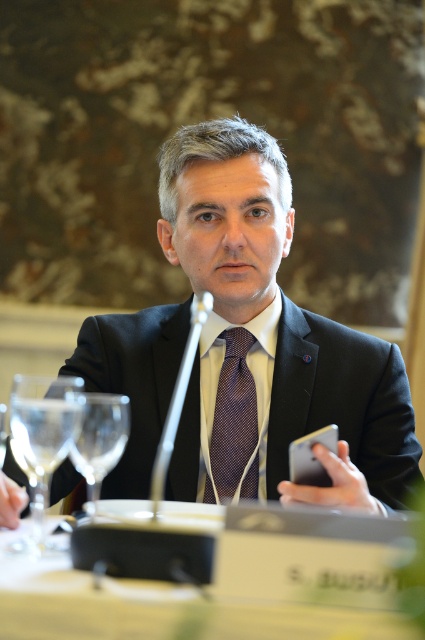
Question: Which object is positioned farthest from the clear glass wine glass at left?

Choices:
 (A) matte black suit at center
 (B) transparent glass at left

Answer: (A)

Question: Which of the following is the closest to the observer?

Choices:
 (A) white plastic table at center
 (B) transparent glass at left

Answer: (A)

Question: Does transparent glass at left appear on the right side of purple dotted tie at center?

Choices:
 (A) yes
 (B) no

Answer: (B)

Question: Where is matte black suit at center located in relation to purple dotted tie at center in the image?

Choices:
 (A) below
 (B) above

Answer: (B)

Question: Does white plastic table at center have a lesser width compared to purple dotted tie at center?

Choices:
 (A) no
 (B) yes

Answer: (A)

Question: Considering the real-world distances, which object is closest to the white plastic table at center?

Choices:
 (A) matte black suit at center
 (B) clear glass wine glass at left
 (C) purple dotted tie at center

Answer: (B)